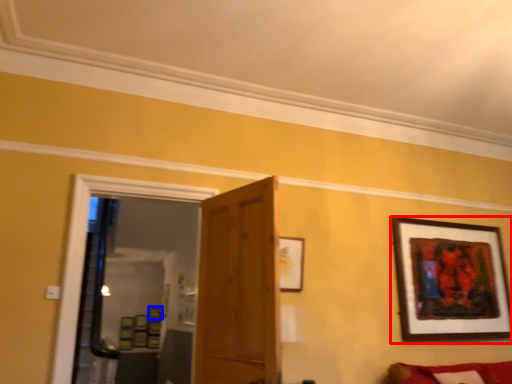
Question: Among these objects, which one is nearest to the camera, picture frame (highlighted by a red box) or picture frame (highlighted by a blue box)?

Choices:
 (A) picture frame
 (B) picture frame

Answer: (A)